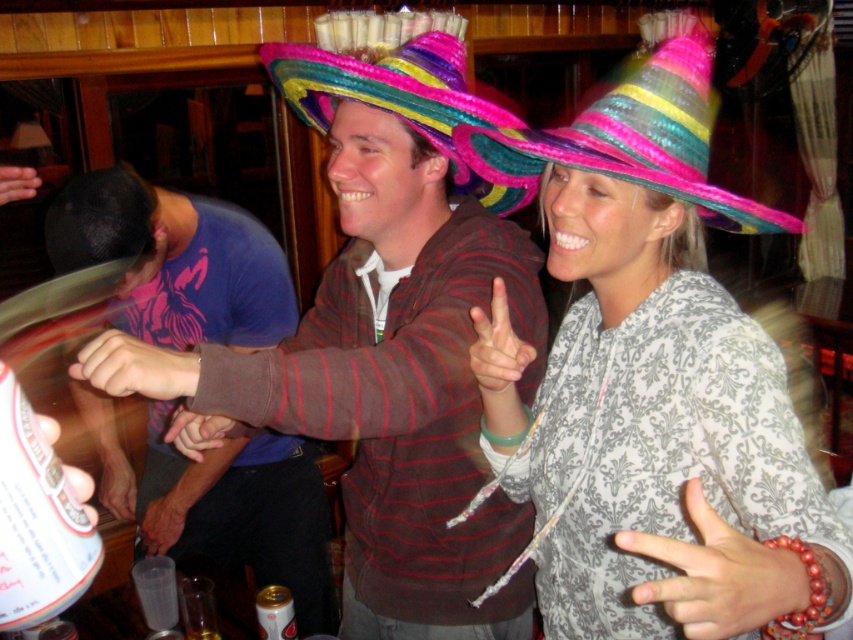
You are organizing a party and want to place a decorative gold metallic can at lower center next to the matte purple fabric at center. Considering their sizes, which object should you place first to ensure there is enough space?

The matte purple fabric at center is wider than the gold metallic can at lower center. Therefore, you should place the matte purple fabric at center first to ensure there is enough space for both items.

You are a photographer at the party and want to capture a closeup of the gold metallic can at lower center. Your camera has a minimum focus distance of 1.5 meters. Can you take the photo without moving closer?

The gold metallic can at lower center is 1.52 meters away from camera. Since the minimum focus distance is 1.5 meters, the camera can focus on the gold metallic can at lower center as it is just slightly beyond the required distance.